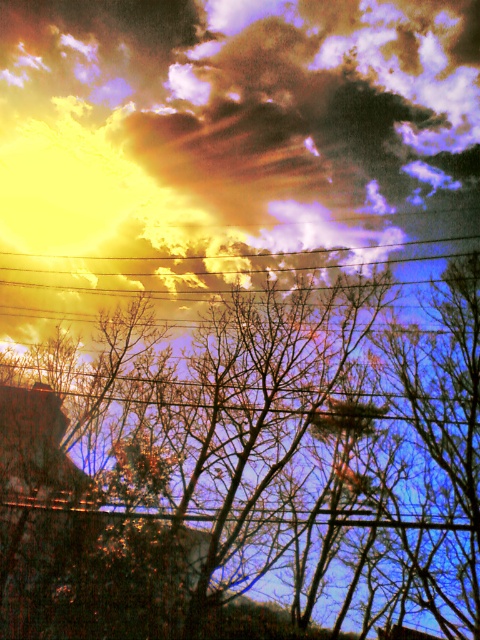
You are an astronomer observing the sky and notice the golden textured cloud at upper center and the metallic wire at upper center. Which object occupies a greater area in the sky?

The golden textured cloud at upper center is larger in size than the metallic wire at upper center, so it occupies a greater area in the sky.

You are an artist trying to paint this scene. You want to make sure the bare branches at center and the golden textured cloud at upper center are positioned correctly. Which object should you paint first to ensure proper layering?

You should paint the golden textured cloud at upper center first because the bare branches at center are closer to the viewer and will be layered on top of the cloud.